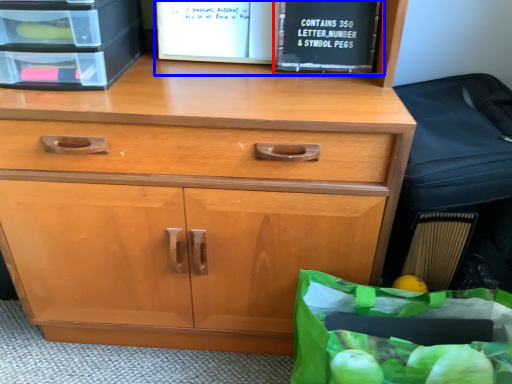
Question: Which point is further to the camera, paperback book (highlighted by a red box) or book (highlighted by a blue box)?

Choices:
 (A) paperback book
 (B) book

Answer: (B)